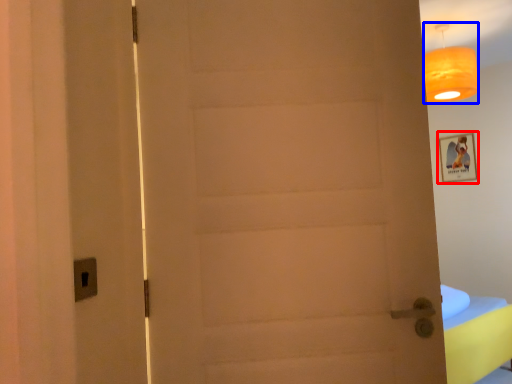
Question: Among these objects, which one is nearest to the camera, picture frame (highlighted by a red box) or lamp (highlighted by a blue box)?

Choices:
 (A) picture frame
 (B) lamp

Answer: (B)